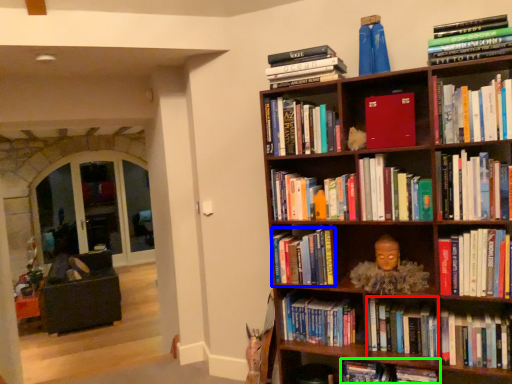
Question: Considering the real-world distances, which object is farthest from book (highlighted by a red box)? book (highlighted by a blue box) or book (highlighted by a green box)?

Choices:
 (A) book
 (B) book

Answer: (A)